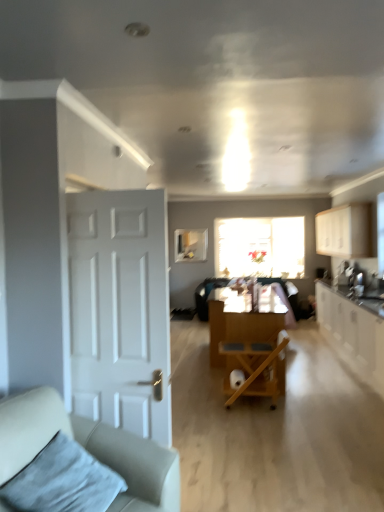
What are the coordinates of `white matte door at left` in the screenshot? It's located at (121, 310).

In order to face wooden folding chair at center, should I rotate leftwards or rightwards?

It's best to rotate right around 8.445 degrees.

Image resolution: width=384 pixels, height=512 pixels. I want to click on white matte door at left, so click(121, 310).

Choose the correct answer: Is clear glass window screen at upper center inside beige fabric couch at left or outside it?

clear glass window screen at upper center is spatially situated outside beige fabric couch at left.

Can you tell me how much clear glass window screen at upper center and beige fabric couch at left differ in facing direction?

The facing directions of clear glass window screen at upper center and beige fabric couch at left are 70 degrees apart.

Are clear glass window screen at upper center and beige fabric couch at left making contact?

clear glass window screen at upper center and beige fabric couch at left are not in contact.

Considering the relative sizes of clear glass window screen at upper center and beige fabric couch at left in the image provided, is clear glass window screen at upper center thinner than beige fabric couch at left?

Correct, the width of clear glass window screen at upper center is less than that of beige fabric couch at left.

From the image's perspective, who appears lower, translucent glass window at center or white glossy cabinets at right, which is counted as the 1th cabinetry, starting from the bottom?

white glossy cabinets at right, which is counted as the 1th cabinetry, starting from the bottom.

Does translucent glass window at center have a lesser height compared to white glossy cabinets at right, which is counted as the 1th cabinetry, starting from the bottom?

Incorrect, the height of translucent glass window at center does not fall short of that of white glossy cabinets at right, which is counted as the 1th cabinetry, starting from the bottom.

The width and height of the screenshot is (384, 512). In order to click on window located on the left of white glossy cabinets at right, placed as the second cabinetry when sorted from top to bottom in this screenshot , I will do `click(260, 247)`.

Based on their sizes in the image, would you say translucent glass window at center is bigger or smaller than white glossy cabinets at right, placed as the second cabinetry when sorted from top to bottom?

In the image, translucent glass window at center appears to be smaller than white glossy cabinets at right, placed as the second cabinetry when sorted from top to bottom.

Between white glossy cabinets at right, placed as the second cabinetry when sorted from top to bottom, and beige fabric couch at left, which one appears on the right side from the viewer's perspective?

white glossy cabinets at right, placed as the second cabinetry when sorted from top to bottom, is more to the right.

Is point (378, 384) in front of point (4, 478)?

That is False.

Looking at this image, from a real-world perspective, is white glossy cabinets at right, which is counted as the 1th cabinetry, starting from the bottom, on beige fabric couch at left?

No.

Which object is further away from the camera, beige fabric couch at left or wooden cart at center?

wooden cart at center is further away from the camera.

In the scene shown: From the image's perspective, is beige fabric couch at left above wooden cart at center?

No, from the image's perspective, beige fabric couch at left is not above wooden cart at center.

Are beige fabric couch at left and wooden cart at center making contact?

They are not placed beside each other.

Can we say beige fabric couch at left lies outside wooden cart at center?

Indeed, beige fabric couch at left is completely outside wooden cart at center.

From the image's perspective, is white glossy cabinets at right, placed as the second cabinetry when sorted from top to bottom, on wooden folding chair at center?

Yes, from the image's perspective, white glossy cabinets at right, placed as the second cabinetry when sorted from top to bottom, is above wooden folding chair at center.

Can you confirm if white glossy cabinets at right, placed as the second cabinetry when sorted from top to bottom, is shorter than wooden folding chair at center?

In fact, white glossy cabinets at right, placed as the second cabinetry when sorted from top to bottom, may be taller than wooden folding chair at center.

In the scene shown: Is white glossy cabinets at right, placed as the second cabinetry when sorted from top to bottom, oriented away from wooden folding chair at center?

white glossy cabinets at right, placed as the second cabinetry when sorted from top to bottom, does not have its back to wooden folding chair at center.

Considering the positions of objects white matte cabinet at upper right, which is the second cabinetry from bottom to top, and wooden cart at center in the image provided, who is more to the left, white matte cabinet at upper right, which is the second cabinetry from bottom to top, or wooden cart at center?

Positioned to the left is wooden cart at center.

Measure the distance from white matte cabinet at upper right, which is the second cabinetry from bottom to top, to wooden cart at center.

The distance of white matte cabinet at upper right, which is the second cabinetry from bottom to top, from wooden cart at center is 3.18 meters.

Does point (319, 251) come farther from viewer compared to point (290, 312)?

Yes, it is.

Is there a large distance between wooden folding chair at center and translucent glass window at center?

Indeed, wooden folding chair at center is not near translucent glass window at center.

Considering the sizes of wooden folding chair at center and translucent glass window at center in the image, is wooden folding chair at center wider or thinner than translucent glass window at center?

wooden folding chair at center is wider than translucent glass window at center.

Between wooden folding chair at center and translucent glass window at center, which one has larger size?

With larger size is translucent glass window at center.

From the image's perspective, between wooden folding chair at center and translucent glass window at center, which one is located above?

translucent glass window at center, from the image's perspective.

You are a GUI agent. You are given a task and a screenshot of the screen. Output one action in this format:
    pyautogui.click(x=<x>, y=<y>)
    Task: Click on the studio couch in front of the clear glass window screen at upper center
    Image resolution: width=384 pixels, height=512 pixels.
    Given the screenshot: What is the action you would take?
    pyautogui.click(x=89, y=449)

Find the location of a particular element. window lying behind the white glossy cabinets at right, placed as the second cabinetry when sorted from top to bottom is located at coordinates (260, 247).

When comparing their distances from velvety gray pillow at lower left, does wooden cart at center or translucent glass window at center seem further?

translucent glass window at center is positioned further to the anchor velvety gray pillow at lower left.

Which object lies nearer to the anchor point velvety gray pillow at lower left, wooden folding chair at center or white matte door at left?

Among the two, white matte door at left is located nearer to velvety gray pillow at lower left.

Which object lies further to the anchor point wooden cart at center, translucent glass window at center or white glossy cabinets at right, which is counted as the 1th cabinetry, starting from the bottom?

Among the two, translucent glass window at center is located further to wooden cart at center.

When comparing their distances from white matte cabinet at upper right, which is the second cabinetry from bottom to top, does translucent glass window at center or white glossy cabinets at right, which is counted as the 1th cabinetry, starting from the bottom, seem closer?

translucent glass window at center lies closer to white matte cabinet at upper right, which is the second cabinetry from bottom to top, than the other object.

When comparing their distances from translucent glass window at center, does wooden folding chair at center or white matte cabinet at upper right, which is the second cabinetry from bottom to top, seem closer?

Based on the image, white matte cabinet at upper right, which is the second cabinetry from bottom to top, appears to be nearer to translucent glass window at center.

When comparing their distances from white matte cabinet at upper right, which is the second cabinetry from bottom to top, does white glossy cabinets at right, which is counted as the 1th cabinetry, starting from the bottom, or wooden folding chair at center seem further?

wooden folding chair at center.

When comparing their distances from wooden folding chair at center, does velvety gray pillow at lower left or clear glass window screen at upper center seem further?

clear glass window screen at upper center lies further to wooden folding chair at center than the other object.

From the image, which object appears to be farther from wooden cart at center, clear glass window screen at upper center or beige fabric couch at left?

clear glass window screen at upper center.

This screenshot has height=512, width=384. I want to click on door located between velvety gray pillow at lower left and white matte cabinet at upper right, the first cabinetry when ordered from top to bottom, in the depth direction, so click(x=121, y=310).

Image resolution: width=384 pixels, height=512 pixels. In order to click on cabinetry between wooden folding chair at center and clear glass window screen at upper center in the front-back direction in this screenshot , I will do `click(345, 231)`.

Find the location of a particular element. table positioned between white matte door at left and translucent glass window at center from near to far is located at coordinates (244, 319).

You are a GUI agent. You are given a task and a screenshot of the screen. Output one action in this format:
    pyautogui.click(x=<x>, y=<y>)
    Task: Click on the table positioned between beige fabric couch at left and white matte cabinet at upper right, which is the second cabinetry from bottom to top, from near to far
    This screenshot has width=384, height=512.
    Given the screenshot: What is the action you would take?
    pyautogui.click(x=244, y=319)